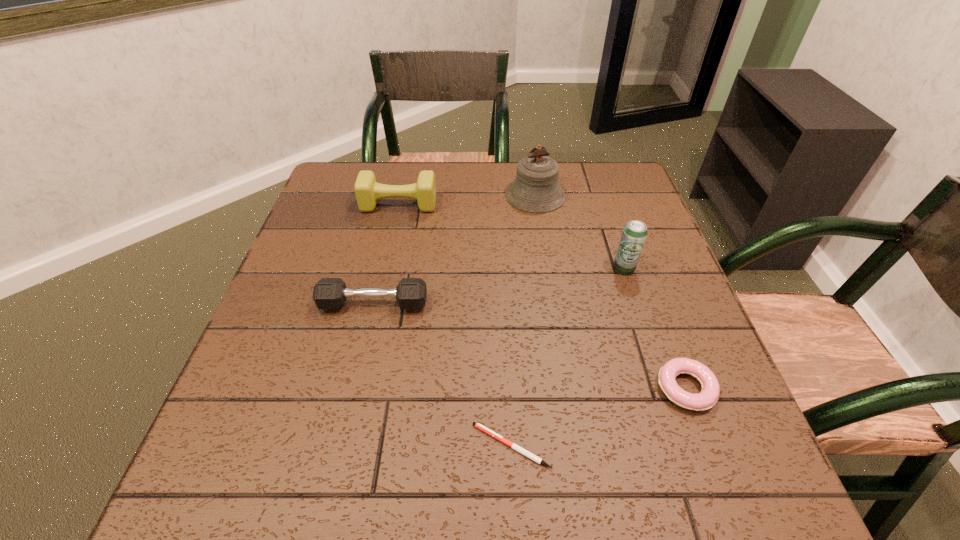
This screenshot has height=540, width=960. In the image, there is a desktop. What are the coordinates of `vacant region at the near right corner` in the screenshot? It's located at (743, 503).

I want to click on empty space that is in between the second shortest object and the shortest object, so click(598, 417).

Find the location of a particular element. Image resolution: width=960 pixels, height=540 pixels. free spot between the second tallest object and the nearest object is located at coordinates (567, 357).

You are a GUI agent. You are given a task and a screenshot of the screen. Output one action in this format:
    pyautogui.click(x=<x>, y=<y>)
    Task: Click on the vacant area that lies between the doughnut and the bell
    This screenshot has width=960, height=540.
    Given the screenshot: What is the action you would take?
    pyautogui.click(x=611, y=292)

The height and width of the screenshot is (540, 960). I want to click on free spot between the tallest object and the fifth shortest object, so (580, 232).

At what (x,y) coordinates should I click in order to perform the action: click on unoccupied position between the fifth farthest object and the nearest object. Please return your answer as a coordinate pair (x, y). The image size is (960, 540). Looking at the image, I should click on point(598,417).

The image size is (960, 540). Find the location of `vacant point located between the fourth shortest object and the fourth farthest object`. vacant point located between the fourth shortest object and the fourth farthest object is located at coordinates (386, 254).

Find the location of `free spot between the farther dumbbell and the shorter dumbbell`. free spot between the farther dumbbell and the shorter dumbbell is located at coordinates (386, 254).

Where is `blank region between the third shortest object and the nearest object`? Image resolution: width=960 pixels, height=540 pixels. blank region between the third shortest object and the nearest object is located at coordinates (443, 375).

Image resolution: width=960 pixels, height=540 pixels. In order to click on unoccupied area between the fifth shortest object and the tallest object in this screenshot , I will do `click(580, 232)`.